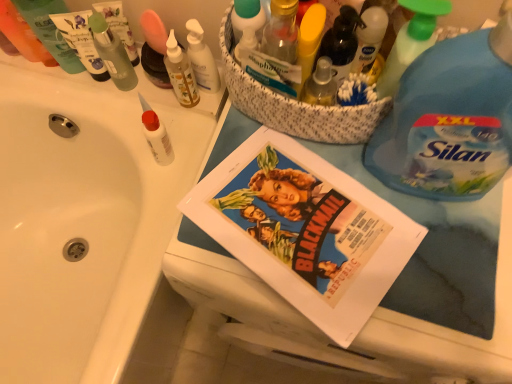
Where is `vacant region above white paper at upper center (from a real-world perspective)`? The height and width of the screenshot is (384, 512). vacant region above white paper at upper center (from a real-world perspective) is located at coordinates (362, 230).